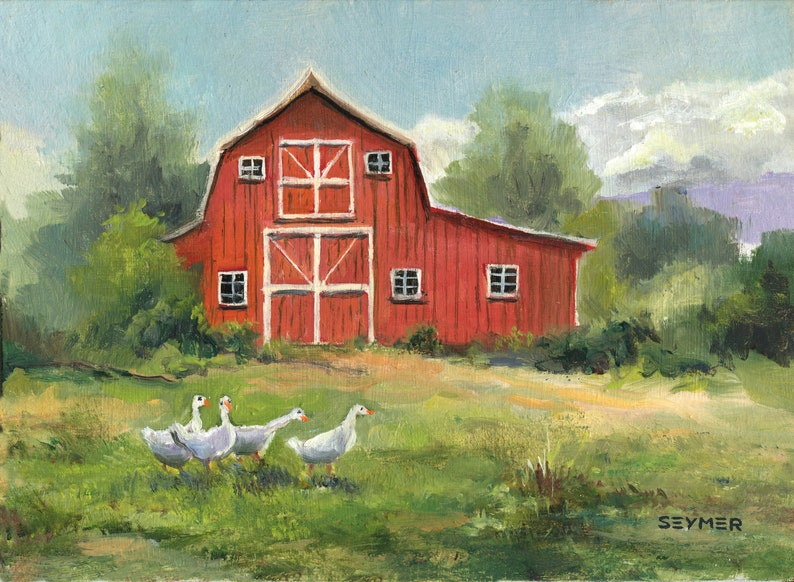
The image size is (794, 582). Find the location of `window`. window is located at coordinates (234, 281), (249, 165), (376, 156), (407, 283), (499, 276).